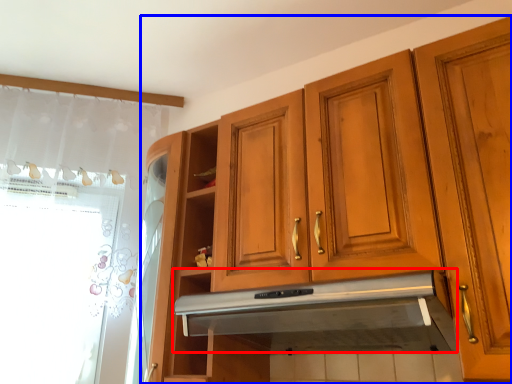
Question: Which object is further to the camera taking this photo, exhaust hood (highlighted by a red box) or cabinetry (highlighted by a blue box)?

Choices:
 (A) exhaust hood
 (B) cabinetry

Answer: (A)